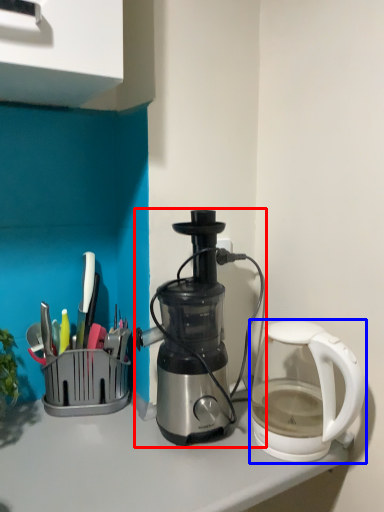
Question: Among these objects, which one is nearest to the camera, coffee maker (highlighted by a red box) or kettle (highlighted by a blue box)?

Choices:
 (A) coffee maker
 (B) kettle

Answer: (B)